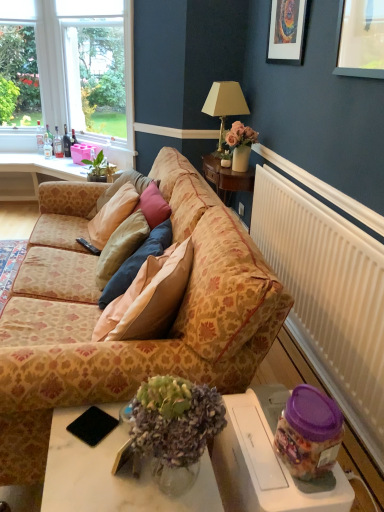
Question: Considering the relative positions of matte glass bottle at center, the first bottle viewed from the right, and purple plastic jar at lower right in the image provided, is matte glass bottle at center, the first bottle viewed from the right, to the right of purple plastic jar at lower right from the viewer's perspective?

Choices:
 (A) yes
 (B) no

Answer: (B)

Question: Is matte glass bottle at center, placed as the 4th bottle when sorted from left to right, not inside purple plastic jar at lower right?

Choices:
 (A) no
 (B) yes

Answer: (B)

Question: From a real-world perspective, is matte glass bottle at center, the first bottle viewed from the right, over purple plastic jar at lower right?

Choices:
 (A) no
 (B) yes

Answer: (B)

Question: Is matte glass bottle at center, the first bottle viewed from the right, taller than purple plastic jar at lower right?

Choices:
 (A) yes
 (B) no

Answer: (B)

Question: From a real-world perspective, is matte glass bottle at center, placed as the 4th bottle when sorted from left to right, beneath purple plastic jar at lower right?

Choices:
 (A) no
 (B) yes

Answer: (A)

Question: Considering their positions, is clear glass bottle at left, the 3th bottle viewed from the left, located in front of or behind black matte pad at lower left?

Choices:
 (A) front
 (B) behind

Answer: (B)

Question: Is clear glass bottle at left, the 3th bottle viewed from the left, wider or thinner than black matte pad at lower left?

Choices:
 (A) thin
 (B) wide

Answer: (A)

Question: Do you think clear glass bottle at left, acting as the 2th bottle starting from the right, is within black matte pad at lower left, or outside of it?

Choices:
 (A) outside
 (B) inside

Answer: (A)

Question: Looking at the image, does clear glass bottle at left, acting as the 2th bottle starting from the right, seem bigger or smaller compared to black matte pad at lower left?

Choices:
 (A) big
 (B) small

Answer: (A)

Question: Does point (99, 77) appear closer or farther from the camera than point (99, 158)?

Choices:
 (A) closer
 (B) farther

Answer: (B)

Question: Is clear glass window at upper left taller or shorter than green leafy plant at upper left?

Choices:
 (A) short
 (B) tall

Answer: (B)

Question: Relative to green leafy plant at upper left, is clear glass window at upper left in front or behind?

Choices:
 (A) behind
 (B) front

Answer: (A)

Question: Is clear glass window at upper left situated inside green leafy plant at upper left or outside?

Choices:
 (A) outside
 (B) inside

Answer: (A)

Question: Choose the correct answer: Is purple plastic jar at lower right inside clear glass bottle at left, the 3th bottle when ordered from right to left, or outside it?

Choices:
 (A) outside
 (B) inside

Answer: (A)

Question: Is purple plastic jar at lower right taller or shorter than clear glass bottle at left, the 3th bottle when ordered from right to left?

Choices:
 (A) tall
 (B) short

Answer: (A)